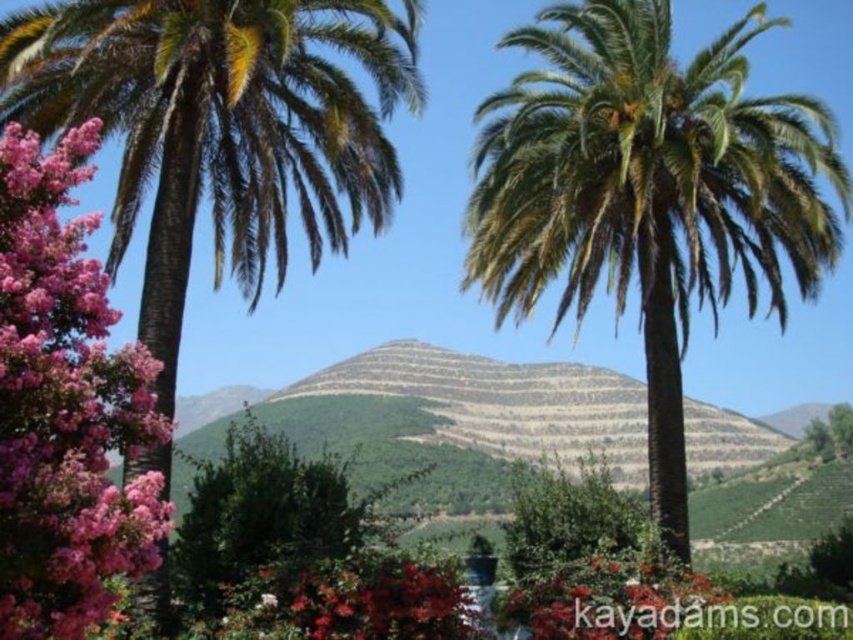
You are standing in the garden and want to take a photo of the green leafy palm tree at left and the green leafy bush at center. Which object will appear larger in the photo?

The green leafy palm tree at left will appear larger in the photo because it is closer to you than the green leafy bush at center.

You are standing in the garden and want to pick a flower. You see the vivid red petals at center and the green leafy bush at center. Which one is located to the left?

The vivid red petals at center are to the left of the green leafy bush at center.